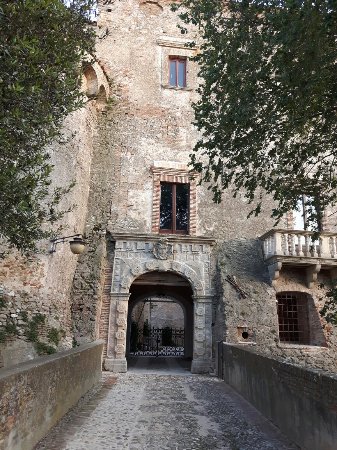
Where is `statue`? statue is located at coordinates (164, 247).